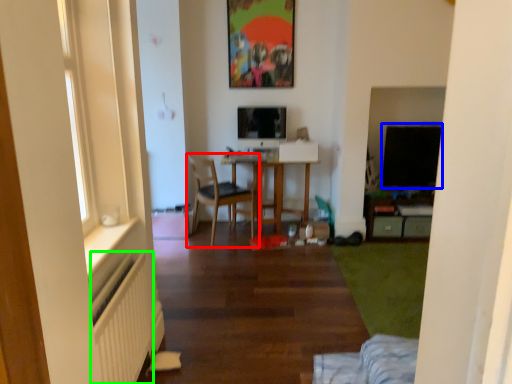
Question: Considering the real-world distances, which object is closest to chair (highlighted by a red box)? window screen (highlighted by a blue box) or radiator (highlighted by a green box).

Choices:
 (A) window screen
 (B) radiator

Answer: (A)